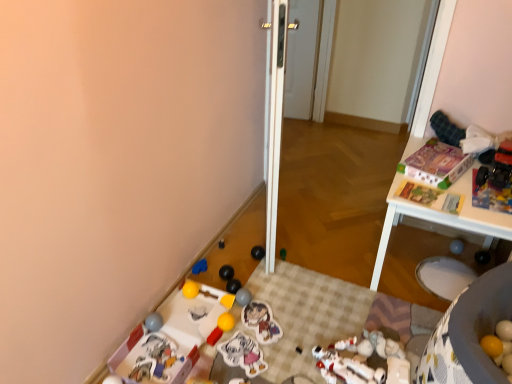
This screenshot has height=384, width=512. In order to click on vacant region above white plastic table at upper right (from a real-world perspective) in this screenshot , I will do `click(448, 175)`.